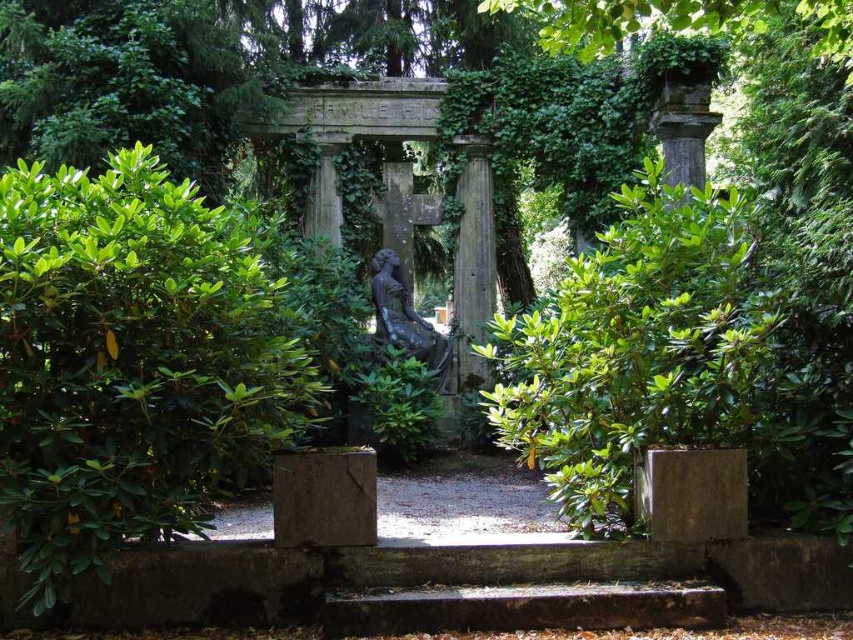
Question: Estimate the real-world distances between objects in this image. Which object is farther from the green leafy bush at center?

Choices:
 (A) stone column at center
 (B) bronze statue at center

Answer: (A)

Question: Among these objects, which one is nearest to the camera?

Choices:
 (A) stone column at center
 (B) bronze statue at center

Answer: (B)

Question: Observing the image, what is the correct spatial positioning of stone column at center in reference to bronze statue at center?

Choices:
 (A) above
 (B) below

Answer: (A)

Question: Is green leafy bush at center positioned before bronze statue at center?

Choices:
 (A) yes
 (B) no

Answer: (A)

Question: Which point is farther to the camera?

Choices:
 (A) (235, 436)
 (B) (392, 330)
 (C) (456, 368)

Answer: (C)

Question: Is green leafy bush at center above bronze statue at center?

Choices:
 (A) yes
 (B) no

Answer: (B)